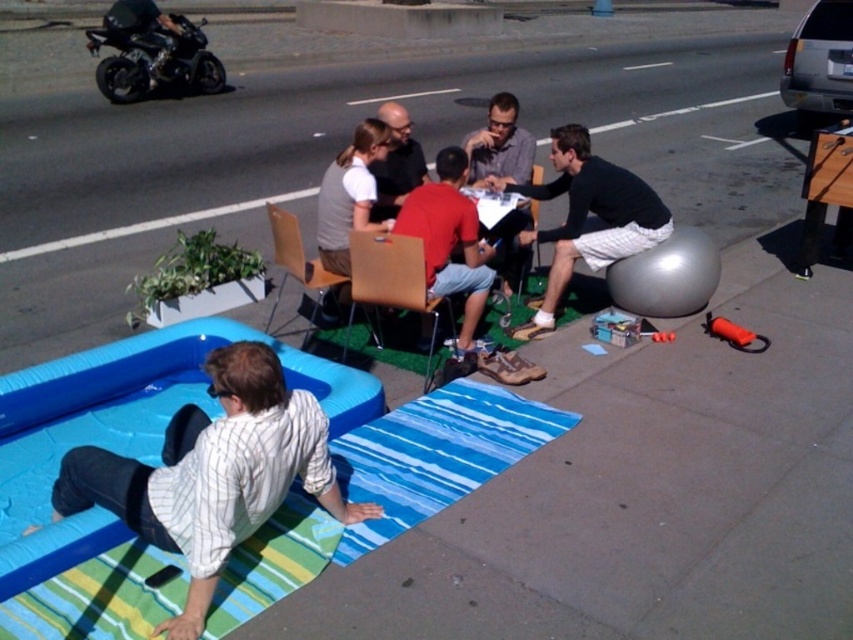
You are a photographer trying to capture a candid shot of the black cotton shirt at center and the wooden chair at center. Since you want to focus on both subjects equally, which one should you zoom in on more to ensure they appear the same size in the photo?

The black cotton shirt at center is larger in size than the wooden chair at center, so you should zoom in more on the wooden chair at center to make them appear the same size in the photo.

You are standing at the point labeled as point (532, 220) and want to walk towards the point labeled as point (573, 128). Which direction should you face?

You should face forward because point (573, 128) is in front of point (532, 220).